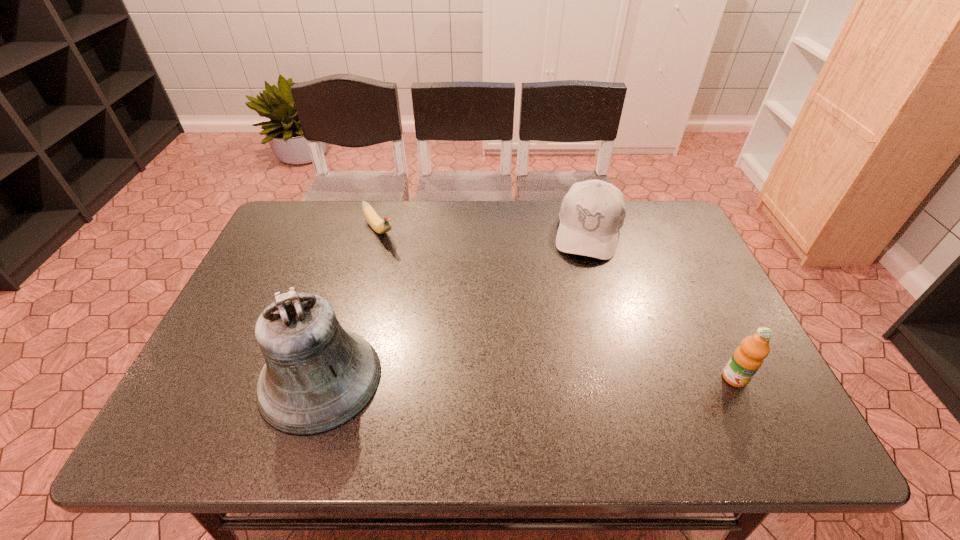
At what (x,y) coordinates should I click in order to perform the action: click on vacant spot on the desktop that is between the bell and the orange juice and is positioned at the stem of the shortest object. Please return your answer as a coordinate pair (x, y). Looking at the image, I should click on pyautogui.click(x=506, y=379).

Locate an element on the screen. vacant space on the desktop that is between the tallest object and the rightmost object and is positioned on the front-facing side of the third object from left to right is located at coordinates (555, 379).